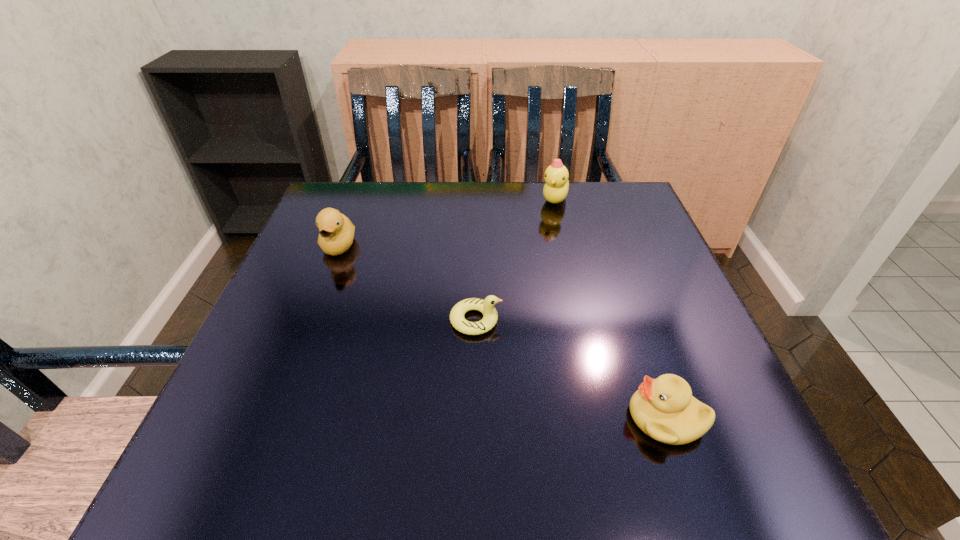
This screenshot has width=960, height=540. Find the location of `the farthest object`. the farthest object is located at coordinates (555, 190).

You are a GUI agent. You are given a task and a screenshot of the screen. Output one action in this format:
    pyautogui.click(x=<x>, y=<y>)
    Task: Click on the second object from right to left
    This screenshot has height=540, width=960.
    Given the screenshot: What is the action you would take?
    pyautogui.click(x=555, y=190)

Locate an element on the screen. The width and height of the screenshot is (960, 540). the third nearest duckling is located at coordinates (336, 235).

This screenshot has width=960, height=540. Identify the location of the leftmost object. (336, 235).

At what (x,y) coordinates should I click in order to perform the action: click on the nearest duckling. Please return your answer as a coordinate pair (x, y). This screenshot has height=540, width=960. Looking at the image, I should click on (663, 408).

Locate an element on the screen. The width and height of the screenshot is (960, 540). the nearest object is located at coordinates (663, 408).

The height and width of the screenshot is (540, 960). I want to click on the shortest duckling, so click(486, 307).

Where is `the third duckling from right to left`? This screenshot has width=960, height=540. the third duckling from right to left is located at coordinates (486, 307).

The height and width of the screenshot is (540, 960). I want to click on vacant space positioned 0.110m on the front-facing side of the farthest object, so click(x=564, y=238).

Locate an element on the screen. free space located 0.090m on the face of the leftmost duckling is located at coordinates (322, 291).